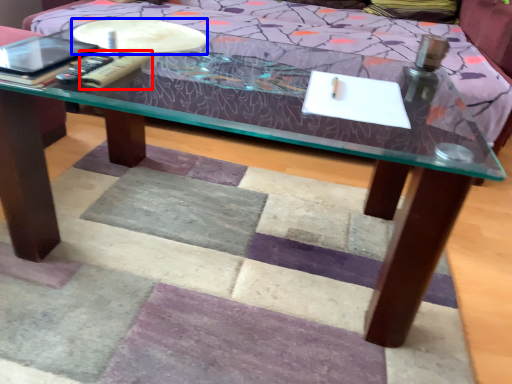
Question: Which point is further to the camera, remote (highlighted by a red box) or round table (highlighted by a blue box)?

Choices:
 (A) remote
 (B) round table

Answer: (B)